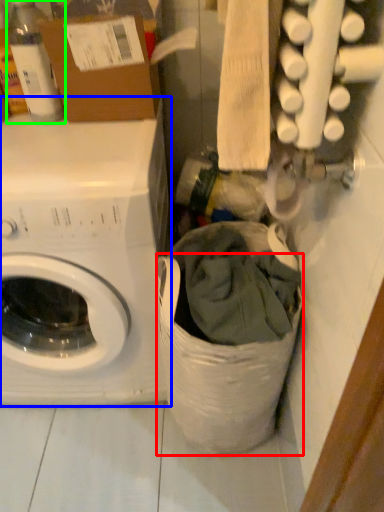
Question: Estimate the real-world distances between objects in this image. Which object is closer to laundry basket (highlighted by a red box), washing machine (highlighted by a blue box) or bottle (highlighted by a green box)?

Choices:
 (A) washing machine
 (B) bottle

Answer: (A)